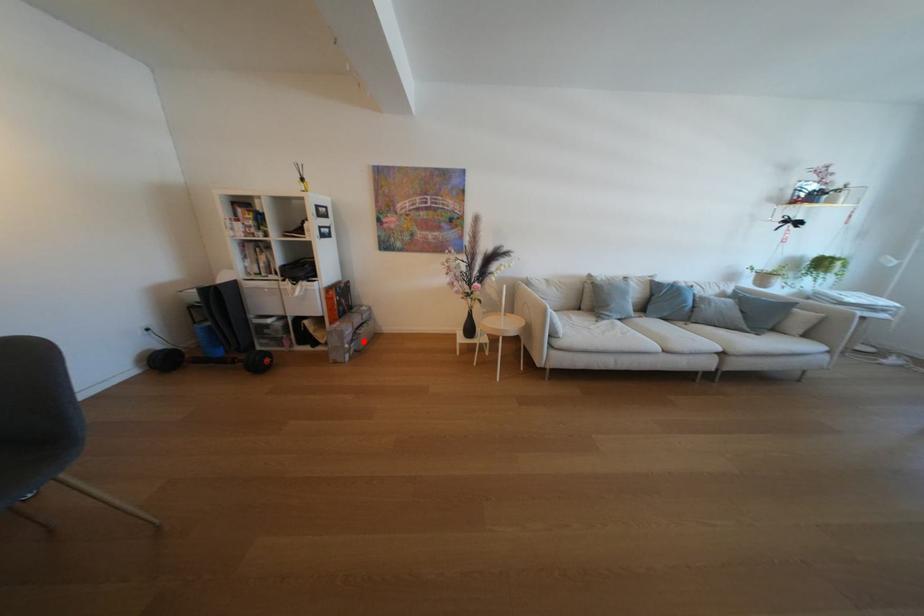
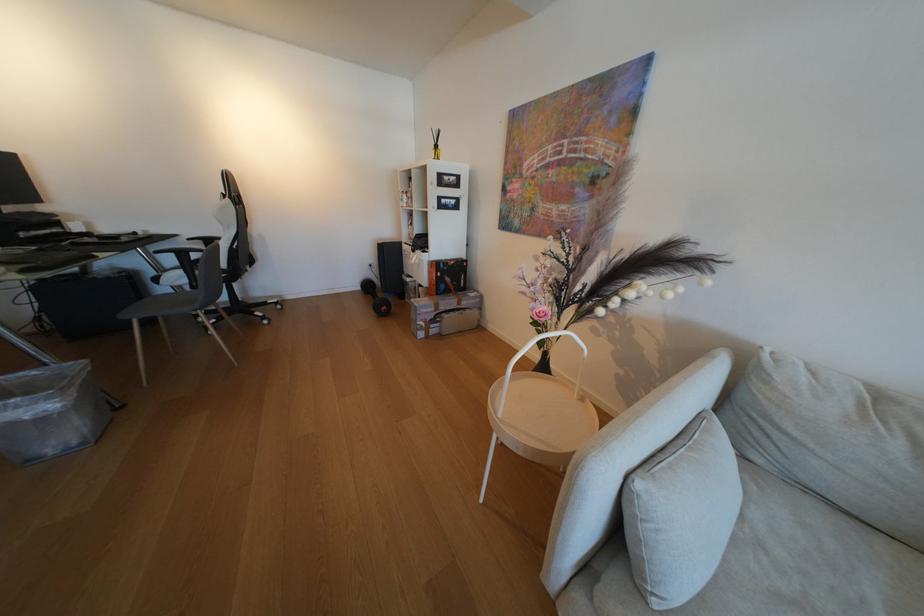
Question: I am providing you with two images of the same scene from different viewpoints. Image1 has a red point marked. In image2, the corresponding 3D location appears at what relative position? Reply with the corresponding letter.

Choices:
 (A) Closer
 (B) Farther

Answer: (B)